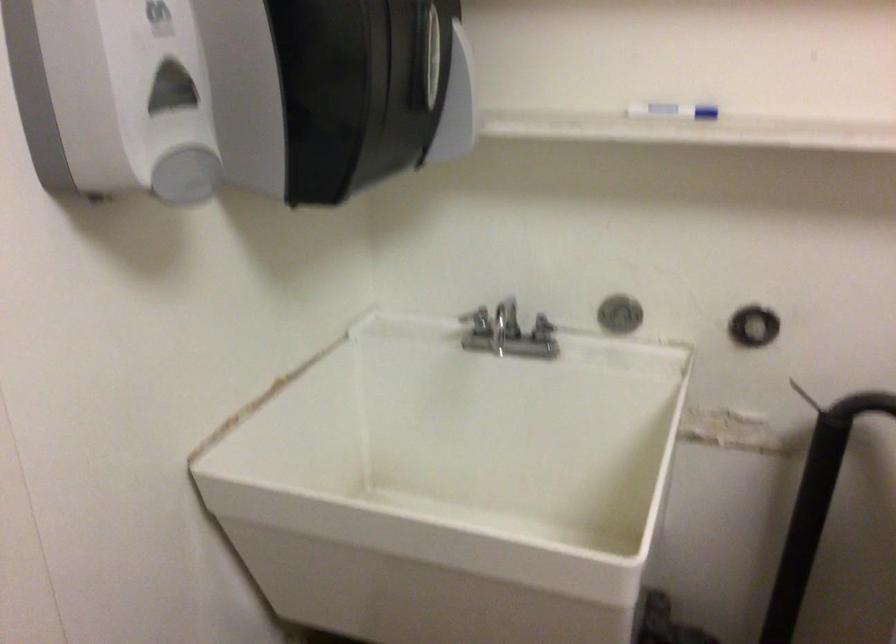
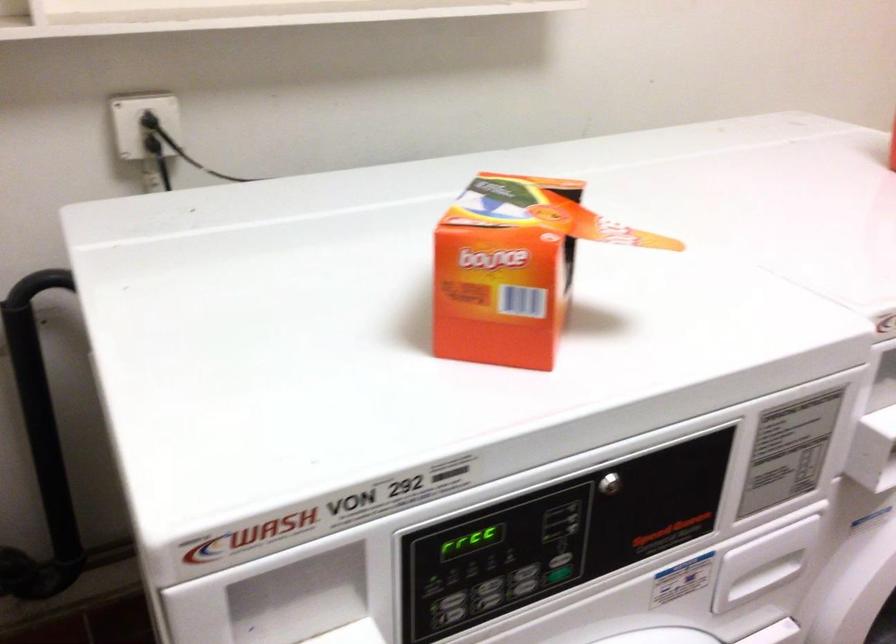
Question: The camera is either moving clockwise (left) or counter-clockwise (right) around the object. The first image is from the beginning of the video and the second image is from the end. Is the camera moving left or right when shooting the video?

Choices:
 (A) Left
 (B) Right

Answer: (A)